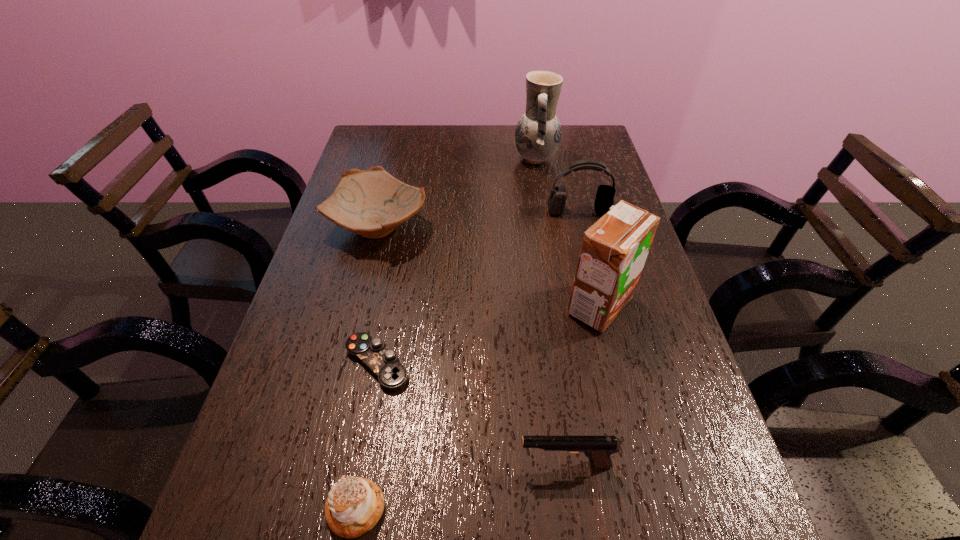
You are a GUI agent. You are given a task and a screenshot of the screen. Output one action in this format:
    pyautogui.click(x=<x>, y=<y>)
    Task: Click on the farthest object
    Image resolution: width=960 pixels, height=540 pixels.
    Given the screenshot: What is the action you would take?
    pyautogui.click(x=538, y=132)

Find the location of a particular element. Image resolution: width=960 pixels, height=540 pixels. the right pottery is located at coordinates (538, 132).

Find the location of a particular element. This screenshot has height=540, width=960. the fourth nearest object is located at coordinates (614, 250).

Locate an element on the screen. the third tallest object is located at coordinates (556, 202).

Image resolution: width=960 pixels, height=540 pixels. I want to click on the shorter pottery, so click(x=372, y=203).

The width and height of the screenshot is (960, 540). Find the location of `the nearer pottery`. the nearer pottery is located at coordinates (372, 203).

You are a GUI agent. You are given a task and a screenshot of the screen. Output one action in this format:
    pyautogui.click(x=<x>, y=<y>)
    Task: Click on the pistol
    The image size is (960, 540).
    Given the screenshot: What is the action you would take?
    pyautogui.click(x=598, y=449)

At what (x,y) coordinates should I click in order to perform the action: click on the third nearest object. Please return your answer as a coordinate pair (x, y). Looking at the image, I should click on (384, 363).

Locate an element on the screen. This screenshot has height=540, width=960. the shortest object is located at coordinates [x=384, y=363].

Find the location of a particular element. The width and height of the screenshot is (960, 540). vacant point located on either side of the right pottery is located at coordinates (430, 159).